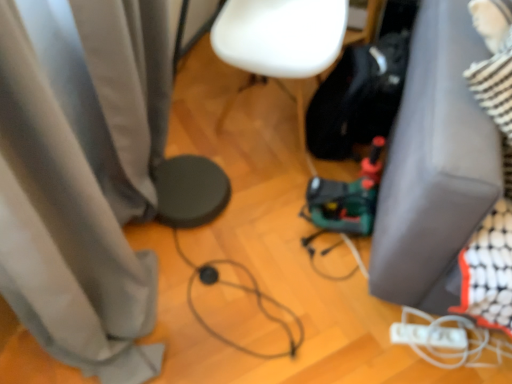
The image size is (512, 384). I want to click on free spot below white matte chair at center (from a real-world perspective), so click(268, 117).